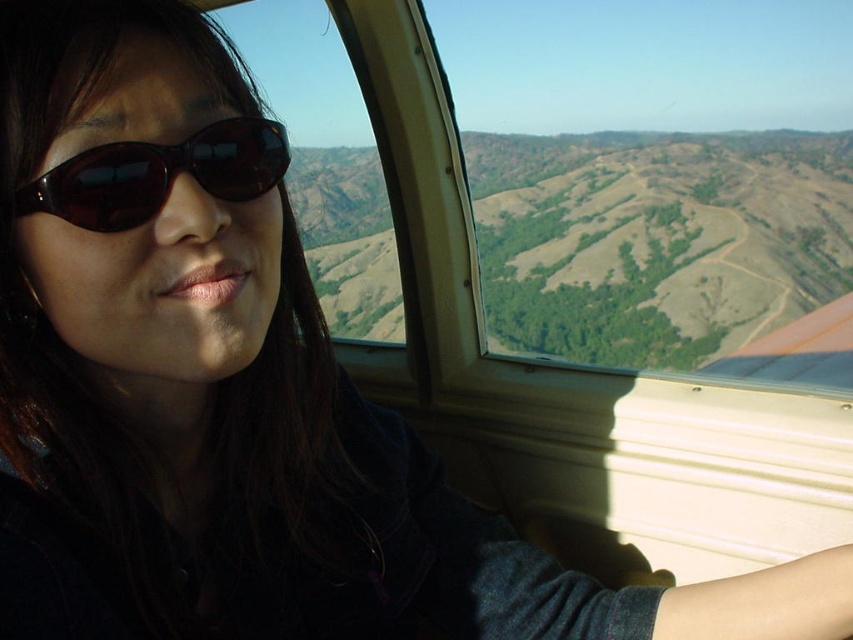
Looking at this image, you are a passenger in the aircraft and want to take a photo of the scenic landscape outside. The transparent glass window at upper center and sunglasses at left are in your view. Which object is wider, and would it provide a better view for the photo?

The transparent glass window at upper center might be wider than sunglasses at left, so it would provide a better view for taking the photo.

You are inside an aircraft and want to take a photo of the scenic landscape outside. The transparent glass window at upper center and sunglasses at left are in your view. Which object allows you to see the landscape more clearly?

The transparent glass window at upper center allows you to see the landscape more clearly because it has a greater height compared to the sunglasses at left, providing a larger viewing area.